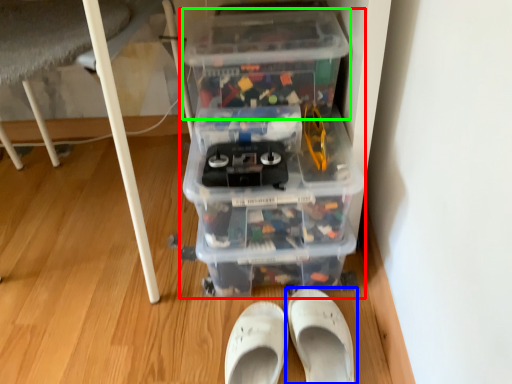
Question: Considering the real-world distances, which object is closest to storage box (highlighted by a red box)? footwear (highlighted by a blue box) or storage box (highlighted by a green box).

Choices:
 (A) footwear
 (B) storage box

Answer: (B)